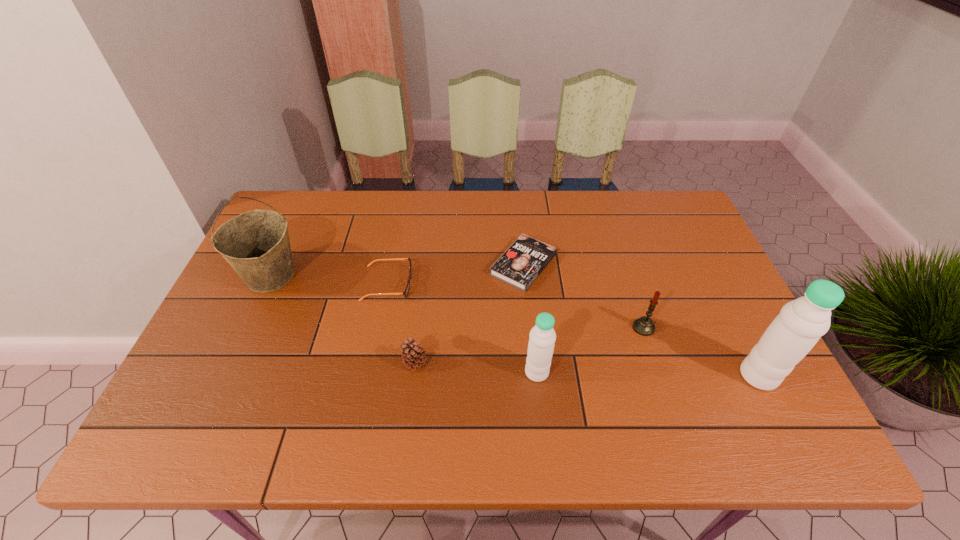
Please point a free position for a water bottle on the left. Please provide its 2D coordinates. Your answer should be formatted as a tuple, i.e. [(x, y)], where the tuple contains the x and y coordinates of a point satisfying the conditions above.

[(318, 369)]